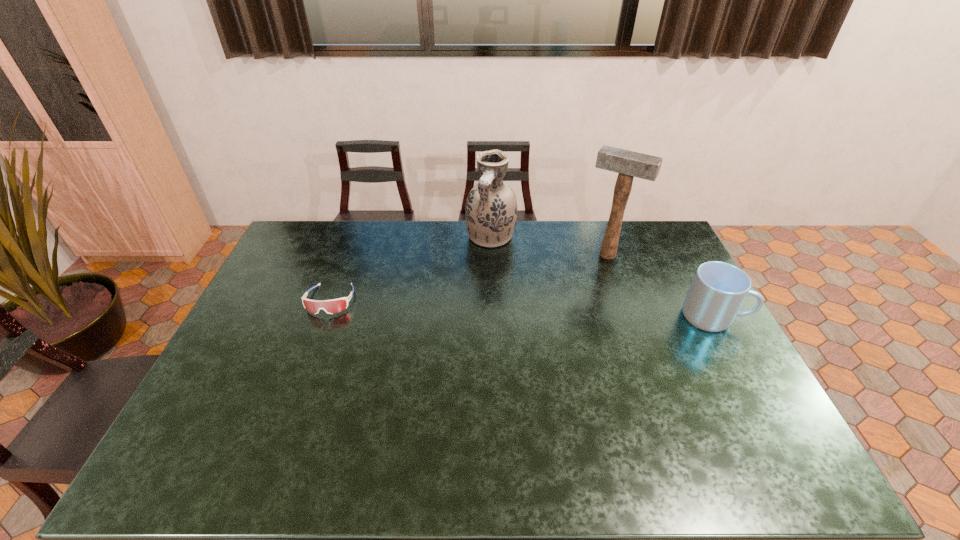
Find the location of a particular element. Image resolution: width=960 pixels, height=540 pixels. free area in between the third object from left to right and the second object from left to right is located at coordinates (549, 246).

What are the coordinates of `vacant space that's between the shortest object and the third object from left to right` in the screenshot? It's located at (468, 277).

Identify the location of blank region between the mallet and the second shortest object. (660, 285).

I want to click on object that is the closest to the third shortest object, so click(628, 164).

Find the location of a particular element. The height and width of the screenshot is (540, 960). object that stands as the closest to the mallet is located at coordinates (718, 289).

Locate an element on the screen. vacant area that satisfies the following two spatial constraints: 1. on the front-facing side of the mug; 2. on the left side of the leftmost object is located at coordinates (324, 316).

Identify the location of blank area in the image that satisfies the following two spatial constraints: 1. on the front-facing side of the shortest object; 2. on the right side of the rightmost object. (324, 316).

Where is `vacant space that satisfies the following two spatial constraints: 1. on the front side of the mug; 2. on the left side of the vase`? This screenshot has width=960, height=540. vacant space that satisfies the following two spatial constraints: 1. on the front side of the mug; 2. on the left side of the vase is located at coordinates (493, 316).

The image size is (960, 540). In order to click on vacant space that satisfies the following two spatial constraints: 1. on the front side of the vase; 2. on the left side of the mallet in this screenshot , I will do `click(492, 254)`.